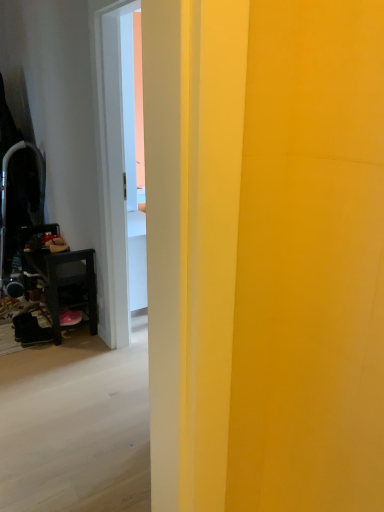
Where is `vacant space to the left of black suede boot at lower left, the 1th footwear from the left`? The height and width of the screenshot is (512, 384). vacant space to the left of black suede boot at lower left, the 1th footwear from the left is located at coordinates (11, 343).